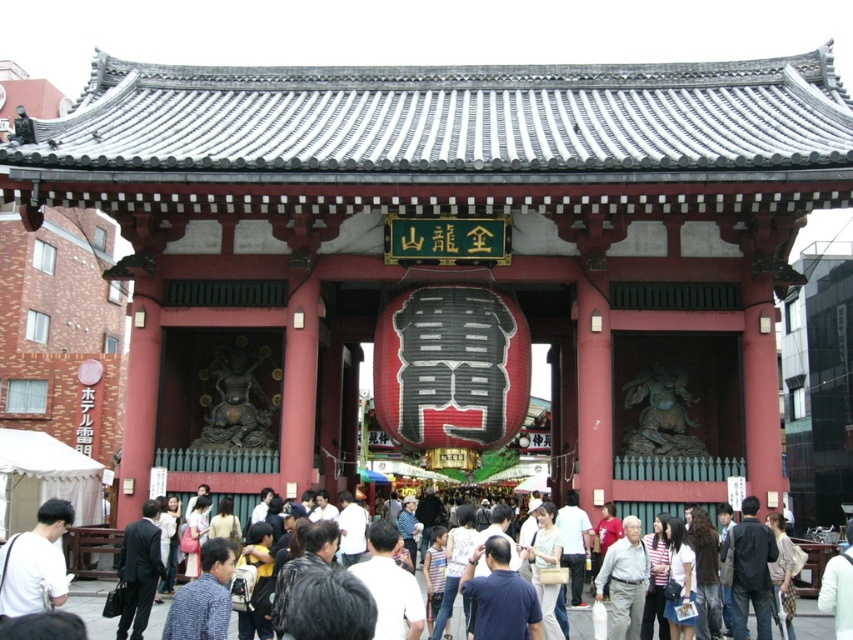
In the scene shown: Which is more to the right, dark brown hair at center or white cotton shirt at center?

dark brown hair at center

Does dark brown hair at center lie in front of white cotton shirt at center?

No.

Is point (700, 586) closer to viewer compared to point (548, 588)?

No, (700, 586) is behind (548, 588).

Find the location of `dark brown hair at center`. dark brown hair at center is located at coordinates (705, 573).

Does gray fabric shirt at center lie behind dark brown hair at center?

Yes.

Locate an element on the screen. Image resolution: width=853 pixels, height=640 pixels. gray fabric shirt at center is located at coordinates (625, 580).

You are a GUI agent. You are given a task and a screenshot of the screen. Output one action in this format:
    pyautogui.click(x=<x>, y=<y>)
    Task: Click on the gray fabric shirt at center
    Image resolution: width=853 pixels, height=640 pixels.
    Given the screenshot: What is the action you would take?
    pyautogui.click(x=625, y=580)

Is gray fabric shirt at center to the right of light brown textured bag at center from the viewer's perspective?

Incorrect, gray fabric shirt at center is not on the right side of light brown textured bag at center.

Which of these two, gray fabric shirt at center or light brown textured bag at center, stands shorter?

Standing shorter between the two is light brown textured bag at center.

The height and width of the screenshot is (640, 853). Identify the location of gray fabric shirt at center. (625, 580).